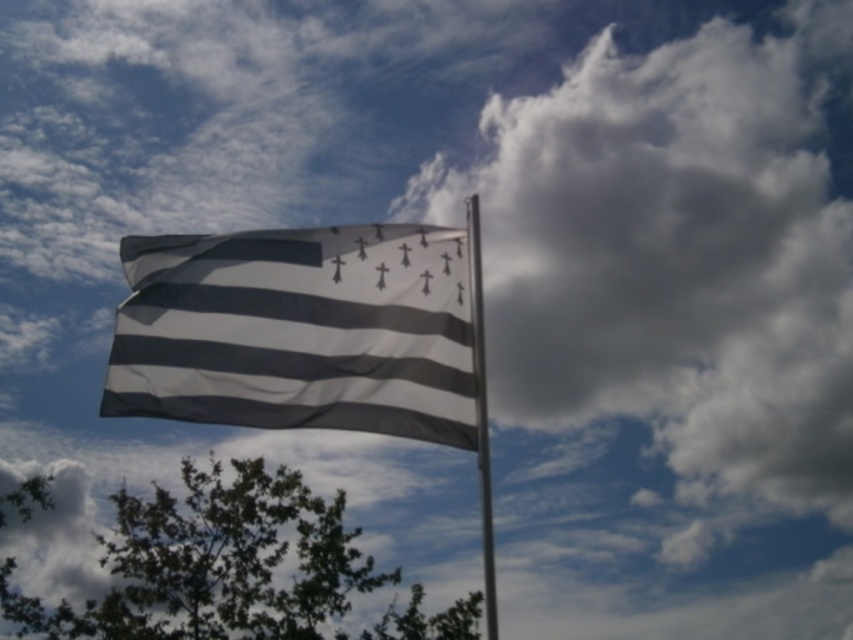
Looking at this image, you are standing in a park and see the black and white striped flag at center and the green leafy tree at lower left. Which object appears taller in the image?

The black and white striped flag at center is taller than the green leafy tree at lower left.

You are a photographer trying to capture the black and white striped flag at center and the metallic pole at center in a single frame. Based on their widths, which object will appear wider in your photo?

The black and white striped flag at center will appear wider in the photo because its width surpasses that of the metallic pole at center.

You are a photographer trying to capture the black and white striped flag at center and the metallic pole at center in a single shot. Based on their sizes, which object should you focus on first to ensure both are in frame?

The black and white striped flag at center is taller than the metallic pole at center, so you should focus on the black and white striped flag at center first to ensure both are in frame.